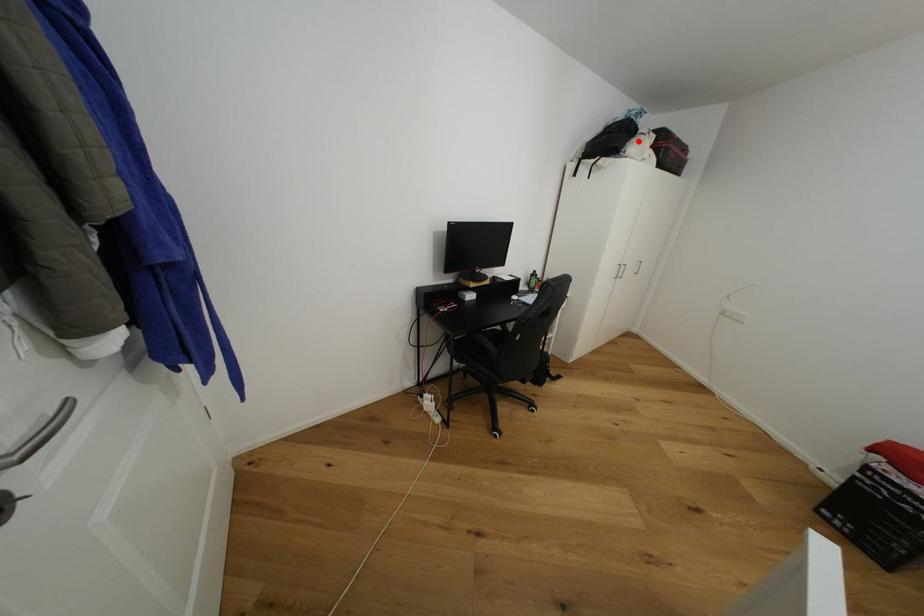
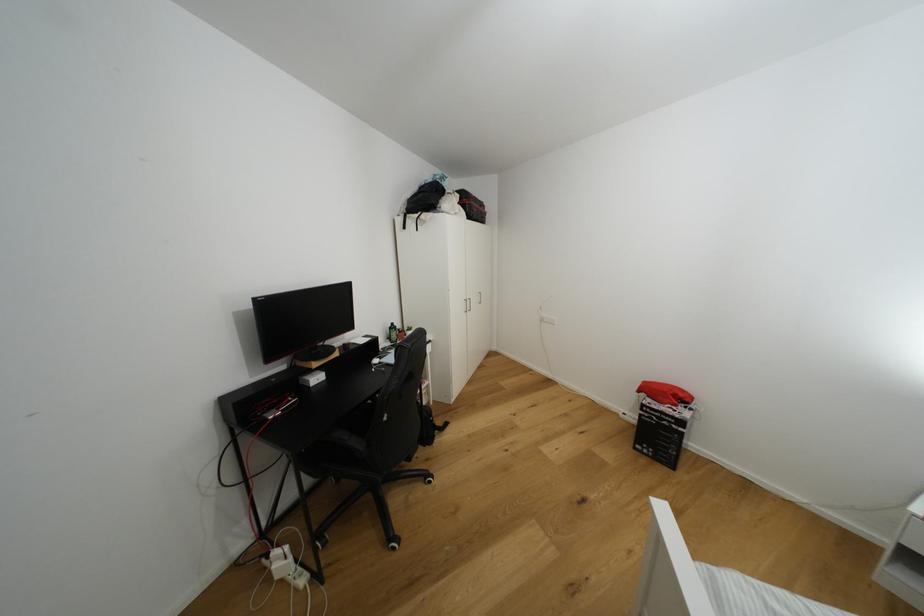
In the second image, find the point that corresponds to the highlighted location in the first image.

(448, 199)